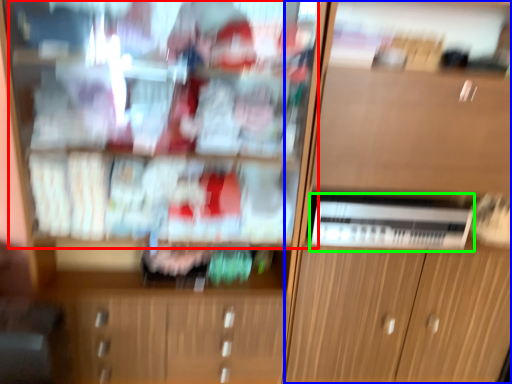
Question: Which object is the farthest from shelf (highlighted by a red box)? Choose among these: cabinetry (highlighted by a blue box) or appliance (highlighted by a green box).

Choices:
 (A) cabinetry
 (B) appliance

Answer: (B)